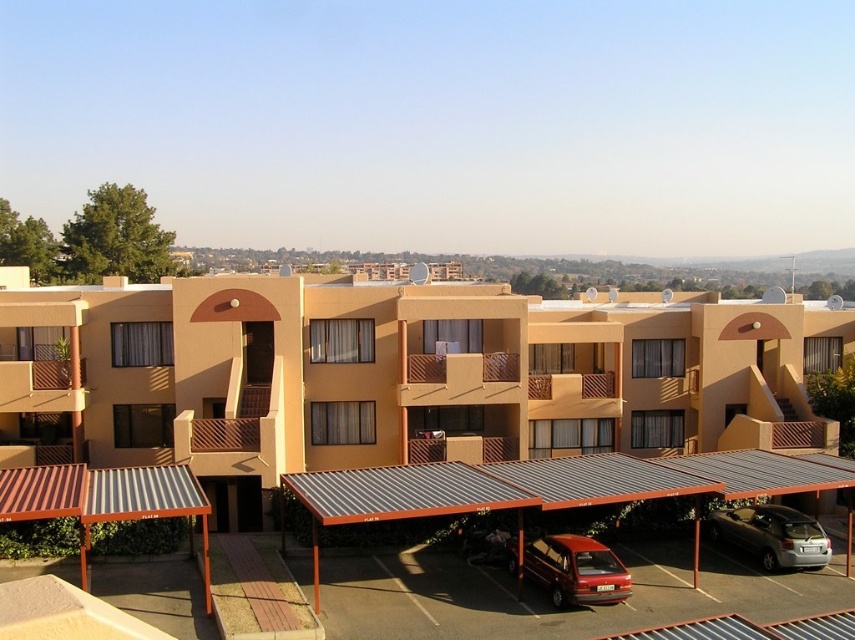
Question: Is metallic red hatchback at lower center to the right of silver metallic car at lower right from the viewer's perspective?

Choices:
 (A) no
 (B) yes

Answer: (A)

Question: Which is farther from the matte brown awning at lower left?

Choices:
 (A) silver metallic car at lower right
 (B) metallic red hatchback at lower center

Answer: (B)

Question: Which point is closer to the camera?

Choices:
 (A) silver metallic car at lower right
 (B) metallic red hatchback at lower center
 (C) matte brown awning at lower left

Answer: (B)

Question: Does metallic red hatchback at lower center have a larger size compared to silver metallic car at lower right?

Choices:
 (A) yes
 (B) no

Answer: (B)

Question: Which object is farther from the camera taking this photo?

Choices:
 (A) matte brown awning at lower left
 (B) silver metallic car at lower right
 (C) metallic red hatchback at lower center

Answer: (A)

Question: Considering the relative positions of metallic red hatchback at lower center and silver metallic car at lower right in the image provided, where is metallic red hatchback at lower center located with respect to silver metallic car at lower right?

Choices:
 (A) left
 (B) right

Answer: (A)